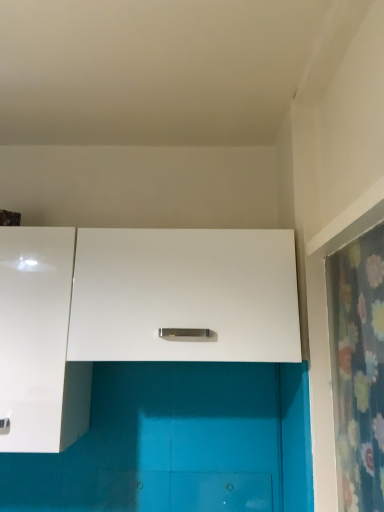
Question: Is white glossy cabinet at left, the 2th cabinetry viewed from the right, to the right of floral fabric shower curtain at right from the viewer's perspective?

Choices:
 (A) yes
 (B) no

Answer: (B)

Question: Is white glossy cabinet at left, the 2th cabinetry viewed from the right, in contact with floral fabric shower curtain at right?

Choices:
 (A) yes
 (B) no

Answer: (B)

Question: Is white glossy cabinet at left, placed as the first cabinetry when sorted from left to right, completely or partially outside of floral fabric shower curtain at right?

Choices:
 (A) no
 (B) yes

Answer: (B)

Question: Does white glossy cabinet at left, the 2th cabinetry viewed from the right, turn towards floral fabric shower curtain at right?

Choices:
 (A) yes
 (B) no

Answer: (B)

Question: From the image's perspective, is white glossy cabinet at left, placed as the first cabinetry when sorted from left to right, beneath floral fabric shower curtain at right?

Choices:
 (A) no
 (B) yes

Answer: (A)

Question: Is point (38, 242) closer or farther from the camera than point (347, 320)?

Choices:
 (A) farther
 (B) closer

Answer: (A)

Question: Looking at the image, does white glossy cabinet at left, the 2th cabinetry viewed from the right, seem bigger or smaller compared to floral fabric shower curtain at right?

Choices:
 (A) big
 (B) small

Answer: (A)

Question: From a real-world perspective, is white glossy cabinet at left, placed as the first cabinetry when sorted from left to right, positioned above or below floral fabric shower curtain at right?

Choices:
 (A) below
 (B) above

Answer: (B)

Question: In terms of width, does white glossy cabinet at left, placed as the first cabinetry when sorted from left to right, look wider or thinner when compared to floral fabric shower curtain at right?

Choices:
 (A) wide
 (B) thin

Answer: (A)

Question: Is white matte cabinet at center, which appears as the first cabinetry when viewed from the right, inside the boundaries of floral fabric shower curtain at right, or outside?

Choices:
 (A) outside
 (B) inside

Answer: (A)

Question: Based on their positions, is white matte cabinet at center, which appears as the first cabinetry when viewed from the right, located to the left or right of floral fabric shower curtain at right?

Choices:
 (A) right
 (B) left

Answer: (B)

Question: From the image's perspective, is white matte cabinet at center, which appears as the first cabinetry when viewed from the right, above or below floral fabric shower curtain at right?

Choices:
 (A) below
 (B) above

Answer: (B)

Question: Looking at their shapes, would you say white matte cabinet at center, the 2th cabinetry from the left, is wider or thinner than floral fabric shower curtain at right?

Choices:
 (A) thin
 (B) wide

Answer: (B)

Question: Looking at their shapes, would you say white matte cabinet at center, the 2th cabinetry from the left, is wider or thinner than white glossy cabinet at left, placed as the first cabinetry when sorted from left to right?

Choices:
 (A) wide
 (B) thin

Answer: (A)

Question: In the image, is white matte cabinet at center, which appears as the first cabinetry when viewed from the right, positioned in front of or behind white glossy cabinet at left, placed as the first cabinetry when sorted from left to right?

Choices:
 (A) behind
 (B) front

Answer: (A)